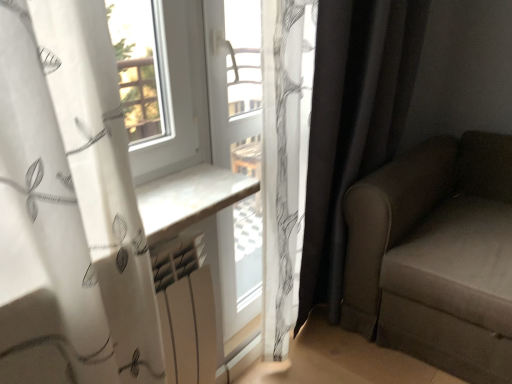
Question: Is white plastic window frame at center to the right of white matte radiator at center from the viewer's perspective?

Choices:
 (A) yes
 (B) no

Answer: (A)

Question: Can you confirm if white plastic window frame at center is taller than white matte radiator at center?

Choices:
 (A) no
 (B) yes

Answer: (B)

Question: Does white plastic window frame at center appear on the left side of white matte radiator at center?

Choices:
 (A) yes
 (B) no

Answer: (B)

Question: Is white plastic window frame at center oriented away from white matte radiator at center?

Choices:
 (A) no
 (B) yes

Answer: (A)

Question: Would you say white plastic window frame at center contains white matte radiator at center?

Choices:
 (A) yes
 (B) no

Answer: (B)

Question: Does white plastic window frame at center have a greater width compared to white matte radiator at center?

Choices:
 (A) no
 (B) yes

Answer: (B)

Question: From a real-world perspective, is black fabric curtain at right physically below suede-like brown couch at right?

Choices:
 (A) no
 (B) yes

Answer: (A)

Question: From the image's perspective, is black fabric curtain at right below suede-like brown couch at right?

Choices:
 (A) yes
 (B) no

Answer: (B)

Question: Is black fabric curtain at right positioned before suede-like brown couch at right?

Choices:
 (A) no
 (B) yes

Answer: (A)

Question: From a real-world perspective, is black fabric curtain at right on top of suede-like brown couch at right?

Choices:
 (A) yes
 (B) no

Answer: (A)

Question: Is black fabric curtain at right further to the viewer compared to suede-like brown couch at right?

Choices:
 (A) no
 (B) yes

Answer: (B)

Question: Is black fabric curtain at right not near suede-like brown couch at right?

Choices:
 (A) no
 (B) yes

Answer: (A)

Question: From a real-world perspective, is white plastic window frame at center located higher than black fabric curtain at right?

Choices:
 (A) no
 (B) yes

Answer: (B)